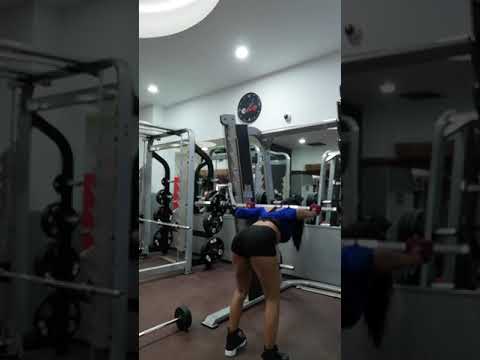
The width and height of the screenshot is (480, 360). Identify the location of walls. (186, 101), (183, 62).